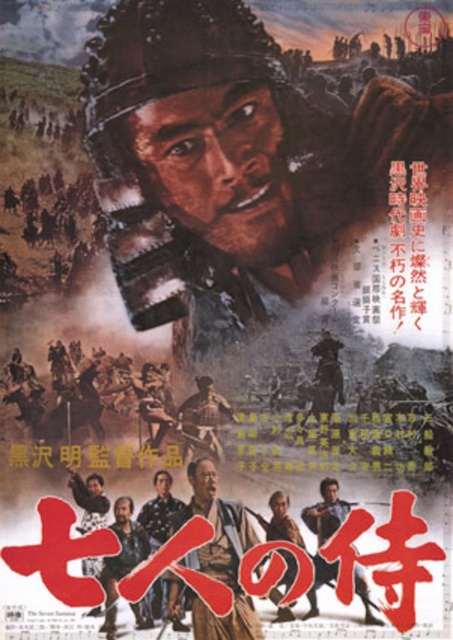
You are a movie poster designer working on the film poster for The Seven Samurai. You need to ensure that the point at coordinate point [159,49] is visible to the audience. Given that the camera is positioned 5.41 meters away from this point, can you confirm if this point will be in the camera frame?

The point at coordinate point [159,49] is 5.41 meters away from the camera. Since the camera can capture this distance within its frame, the point will be visible in the poster.

You are a film historian analyzing the poster of The Seven Samurai. You notice two pieces of armor labeled as matte armor at center and matte brown samurai armor at center. Given their positions, can you determine which one is closer to the viewer?

Both matte armor at center and matte brown samurai armor at center are positioned at the same central area of the poster, but the matte armor at center is closer to the viewer since they are 8.18 feet apart from each other.

You are analyzing the movie poster of The Seven Samurai. There are two points on the battlefield scene below the samurai warrior. The first point is at coordinates point (168, 10) and the second is at point (75, 484). Which point is closer to the viewer?

Point (168, 10) is closer to the camera than point (75, 484).